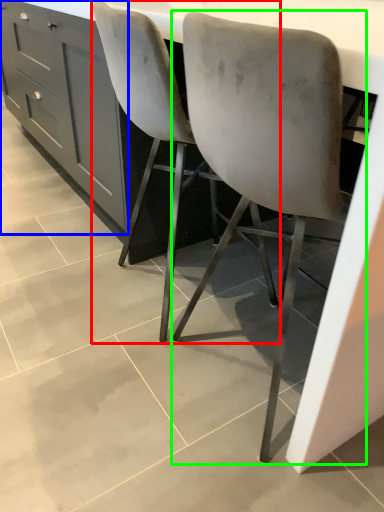
Question: Based on their relative distances, which object is farther from chair (highlighted by a red box)? Choose from cabinetry (highlighted by a blue box) and chair (highlighted by a green box).

Choices:
 (A) cabinetry
 (B) chair

Answer: (A)